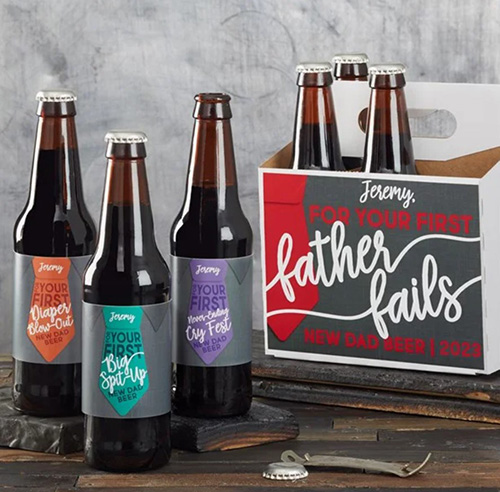
Where is `beer bottles on wood`? The image size is (500, 492). beer bottles on wood is located at coordinates (196, 320), (129, 265), (46, 221).